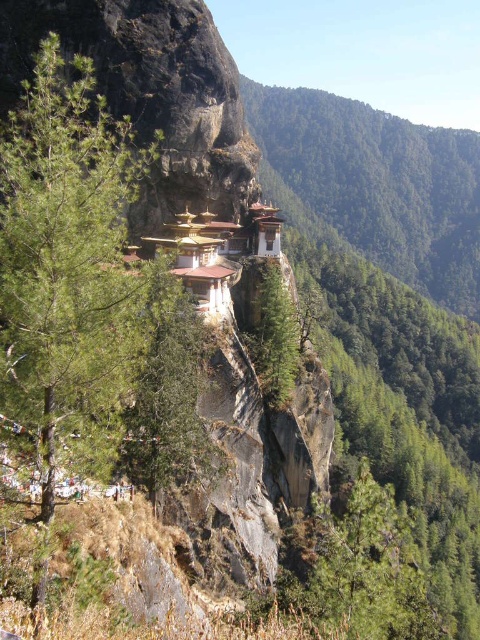
Does green leafy tree at center appear on the right side of green rough bark tree at center?

Yes, green leafy tree at center is to the right of green rough bark tree at center.

Is green leafy tree at center taller than green rough bark tree at center?

Correct, green leafy tree at center is much taller as green rough bark tree at center.

Who is more distant from viewer, (399, 179) or (260, 369)?

Point (399, 179)

This screenshot has width=480, height=640. I want to click on green leafy tree at center, so click(380, 182).